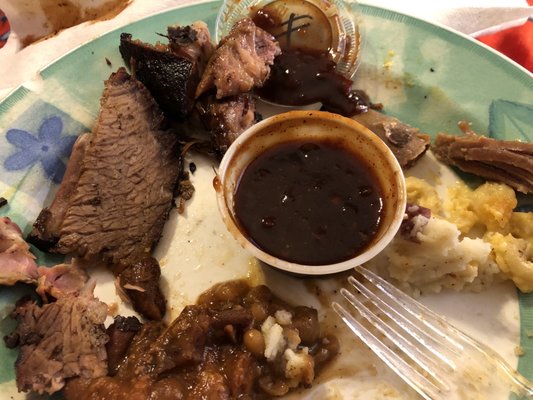
This screenshot has width=533, height=400. I want to click on plastic lid, so click(x=338, y=34), click(x=424, y=334).